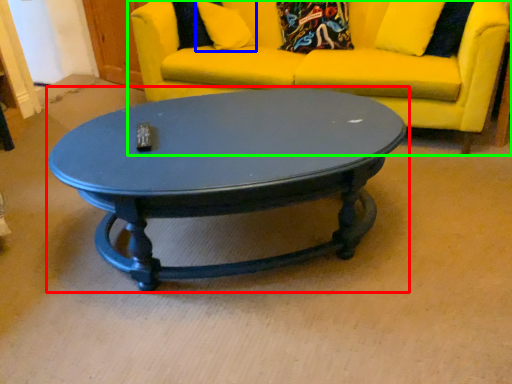
Question: Considering the real-world distances, which object is closest to coffee table (highlighted by a red box)? pillow (highlighted by a blue box) or studio couch (highlighted by a green box).

Choices:
 (A) pillow
 (B) studio couch

Answer: (B)